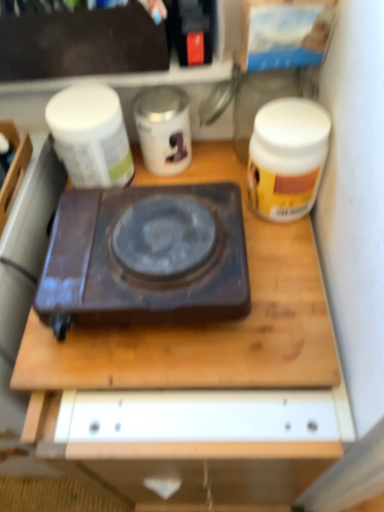
Question: Does point (286, 80) appear closer or farther from the camera than point (312, 158)?

Choices:
 (A) farther
 (B) closer

Answer: (A)

Question: Is transparent glass jar at upper center in front of or behind yellow matte jar at right in the image?

Choices:
 (A) behind
 (B) front

Answer: (A)

Question: Estimate the real-world distances between objects in this image. Which object is closer to the dark brown plastic gas stove at center?

Choices:
 (A) wooden desk at center
 (B) white matte jar at upper left, the first yoghurt when ordered from left to right
 (C) white glossy canister at center, the 1th yoghurt positioned from the right
 (D) matte black box at upper left
 (E) transparent glass jar at upper center

Answer: (A)

Question: Which is farther from the yellow matte jar at right?

Choices:
 (A) wooden desk at center
 (B) matte black box at upper left
 (C) dark brown plastic gas stove at center
 (D) white matte jar at upper left, the 2th yoghurt from the right
 (E) white glossy canister at center, the second yoghurt positioned from the left

Answer: (B)